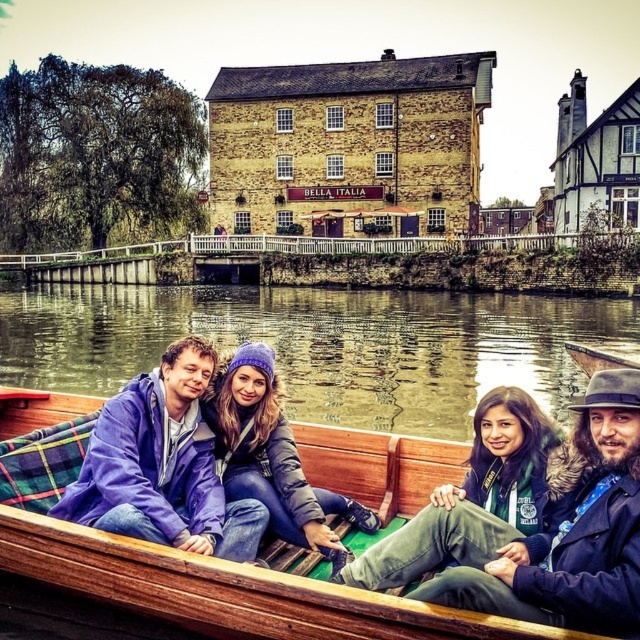
Question: Can you confirm if wooden boat at center is positioned to the left of matte purple beanie at center?

Choices:
 (A) yes
 (B) no

Answer: (A)

Question: Which of these objects is positioned farthest from the green matte jacket at lower right?

Choices:
 (A) greenish-brown water at center
 (B) wooden boat at center
 (C) matte purple beanie at center

Answer: (A)

Question: Which point is closer to the camera?

Choices:
 (A) (205, 628)
 (B) (532, 368)

Answer: (A)

Question: Observing the image, what is the correct spatial positioning of greenish-brown water at center in reference to wooden boat at center?

Choices:
 (A) left
 (B) right

Answer: (A)

Question: Can you confirm if greenish-brown water at center is wider than wooden boat at center?

Choices:
 (A) yes
 (B) no

Answer: (A)

Question: Estimate the real-world distances between objects in this image. Which object is farther from the green matte jacket at lower right?

Choices:
 (A) wooden boat at center
 (B) matte purple beanie at center
 (C) greenish-brown water at center

Answer: (C)